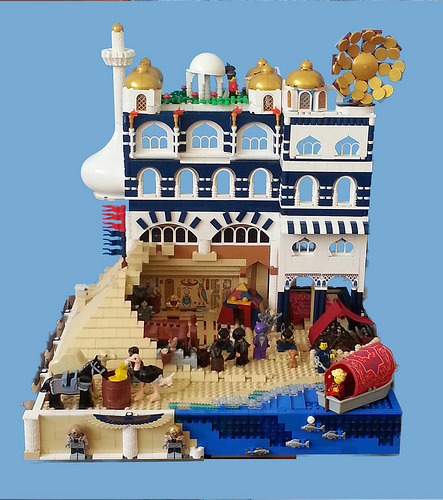
Where is `toy chicken`? The height and width of the screenshot is (500, 443). toy chicken is located at coordinates (172, 343).